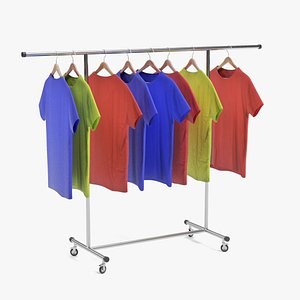
Identify the location of hangers. (53, 66), (72, 68), (105, 65), (127, 69), (150, 61), (167, 62), (192, 63), (225, 61).